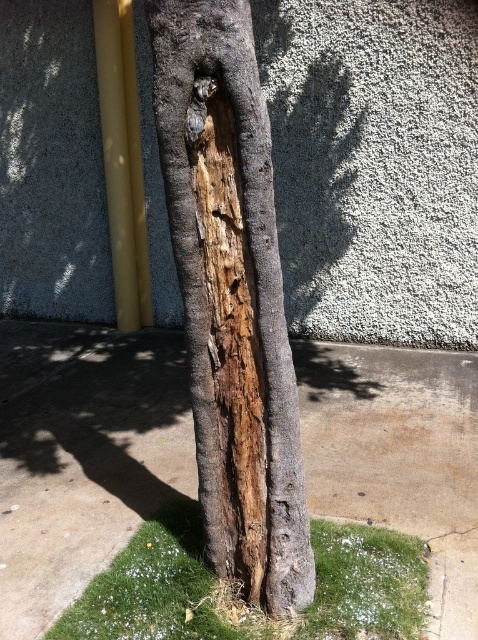
Does brown concrete pavement at center appear under green mossy grass at lower center?

Actually, brown concrete pavement at center is above green mossy grass at lower center.

Is point (43, 352) positioned behind point (420, 563)?

Yes, point (43, 352) is behind point (420, 563).

This screenshot has height=640, width=478. I want to click on brown concrete pavement at center, so click(82, 456).

From the picture: Is brown concrete pavement at center wider than dark brown wood at center?

Yes, brown concrete pavement at center is wider than dark brown wood at center.

Who is shorter, brown concrete pavement at center or dark brown wood at center?

With less height is brown concrete pavement at center.

Which is in front, point (317, 380) or point (246, 156)?

Point (246, 156) is in front.

Where is `brown concrete pavement at center`? This screenshot has width=478, height=640. brown concrete pavement at center is located at coordinates (82, 456).

Is point (267, 234) more distant than point (160, 589)?

No, it is not.

Does dark brown wood at center appear on the left side of green mossy grass at lower center?

Correct, you'll find dark brown wood at center to the left of green mossy grass at lower center.

Is point (250, 557) behind point (134, 602)?

No, it is in front of (134, 602).

I want to click on dark brown wood at center, so click(231, 298).